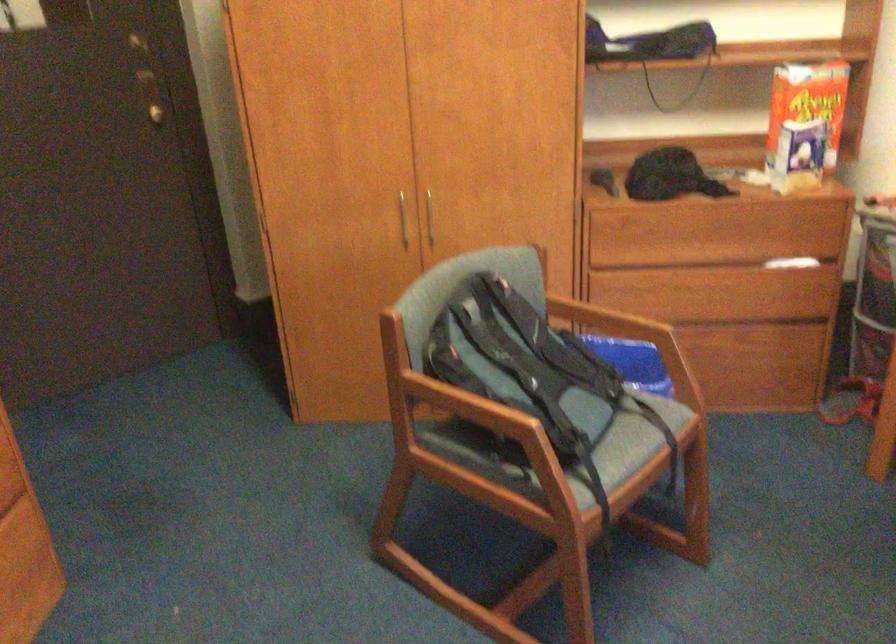
Find where to sit the chair sitting surface. Please return your answer as a coordinate pair (x, y).

(631, 444)